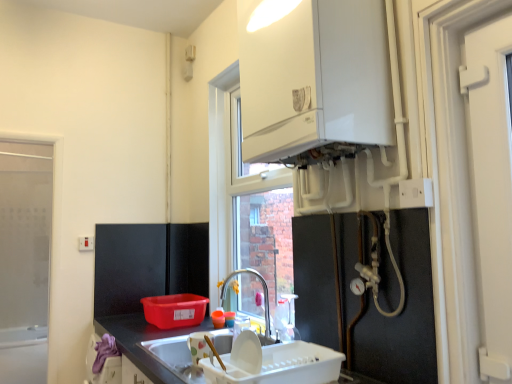
Question: Considering the relative positions of transparent glass window at left and white plastic electrical outlet at upper right, arranged as the second electric outlet when viewed from the back, in the image provided, is transparent glass window at left to the right of white plastic electrical outlet at upper right, arranged as the second electric outlet when viewed from the back, from the viewer's perspective?

Choices:
 (A) yes
 (B) no

Answer: (B)

Question: From the image's perspective, does transparent glass window at left appear lower than white plastic electrical outlet at upper right, the 2th electric outlet viewed from the left?

Choices:
 (A) no
 (B) yes

Answer: (B)

Question: Does transparent glass window at left have a lesser width compared to white plastic electrical outlet at upper right, marked as the first electric outlet in a top-to-bottom arrangement?

Choices:
 (A) yes
 (B) no

Answer: (B)

Question: Is transparent glass window at left smaller than white plastic electrical outlet at upper right, marked as the first electric outlet in a top-to-bottom arrangement?

Choices:
 (A) no
 (B) yes

Answer: (A)

Question: Could you tell me if transparent glass window at left is turned towards white plastic electrical outlet at upper right, positioned as the 1th electric outlet in right-to-left order?

Choices:
 (A) yes
 (B) no

Answer: (B)

Question: From a real-world perspective, is transparent glass window at left on white plastic electrical outlet at upper right, which ranks as the 2th electric outlet in bottom-to-top order?

Choices:
 (A) no
 (B) yes

Answer: (A)

Question: Is metallic silver pipes at lower right, acting as the 2th appliance starting from the bottom, far from white plastic electrical outlet at upper right, the 2th electric outlet viewed from the left?

Choices:
 (A) no
 (B) yes

Answer: (A)

Question: Does metallic silver pipes at lower right, the 1th appliance when ordered from top to bottom, appear on the right side of white plastic electrical outlet at upper right, marked as the first electric outlet in a top-to-bottom arrangement?

Choices:
 (A) no
 (B) yes

Answer: (A)

Question: Considering the relative sizes of metallic silver pipes at lower right, acting as the 2th appliance starting from the bottom, and white plastic electrical outlet at upper right, which ranks as the 2th electric outlet in bottom-to-top order, in the image provided, is metallic silver pipes at lower right, acting as the 2th appliance starting from the bottom, smaller than white plastic electrical outlet at upper right, which ranks as the 2th electric outlet in bottom-to-top order,?

Choices:
 (A) no
 (B) yes

Answer: (A)

Question: From a real-world perspective, is metallic silver pipes at lower right, the 1th appliance when ordered from top to bottom, beneath white plastic electrical outlet at upper right, arranged as the second electric outlet when viewed from the back?

Choices:
 (A) no
 (B) yes

Answer: (B)

Question: From the image's perspective, would you say metallic silver pipes at lower right, the 1th appliance when ordered from top to bottom, is shown under white plastic electrical outlet at upper right, which ranks as the 2th electric outlet in bottom-to-top order?

Choices:
 (A) no
 (B) yes

Answer: (B)

Question: Does metallic silver pipes at lower right, the 1th appliance when ordered from top to bottom, have a lesser height compared to white plastic electrical outlet at upper right, arranged as the second electric outlet when viewed from the back?

Choices:
 (A) no
 (B) yes

Answer: (A)

Question: Can you confirm if white glossy boiler at upper center is smaller than white matte door at right?

Choices:
 (A) yes
 (B) no

Answer: (B)